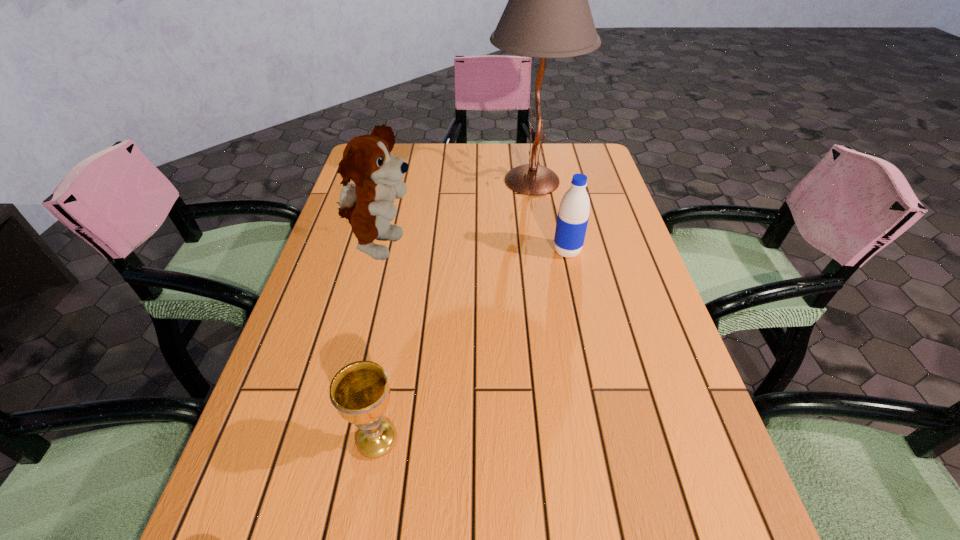
You are a GUI agent. You are given a task and a screenshot of the screen. Output one action in this format:
    pyautogui.click(x=<x>, y=<y>)
    Task: Click on the table lamp
    This screenshot has width=960, height=540.
    Given the screenshot: What is the action you would take?
    click(548, 15)

The height and width of the screenshot is (540, 960). In order to click on the farthest object in this screenshot , I will do `click(548, 15)`.

The height and width of the screenshot is (540, 960). I want to click on the second tallest object, so click(367, 203).

Find the location of a particular element. This screenshot has width=960, height=540. the second shortest object is located at coordinates (573, 215).

This screenshot has width=960, height=540. Identify the location of the nearest object. (360, 392).

The height and width of the screenshot is (540, 960). Identify the location of the shortest object. (360, 392).

I want to click on free point located on the front-facing side of the table lamp, so click(423, 180).

This screenshot has width=960, height=540. What are the coordinates of `free space located 0.230m on the front-facing side of the table lamp` in the screenshot? It's located at (414, 180).

Identify the location of vacant area located on the front-facing side of the table lamp. (360, 180).

At what (x,y) coordinates should I click in order to perform the action: click on free region located 0.150m on the face of the third shortest object. Please return your answer as a coordinate pair (x, y). The image size is (960, 540). Looking at the image, I should click on (476, 247).